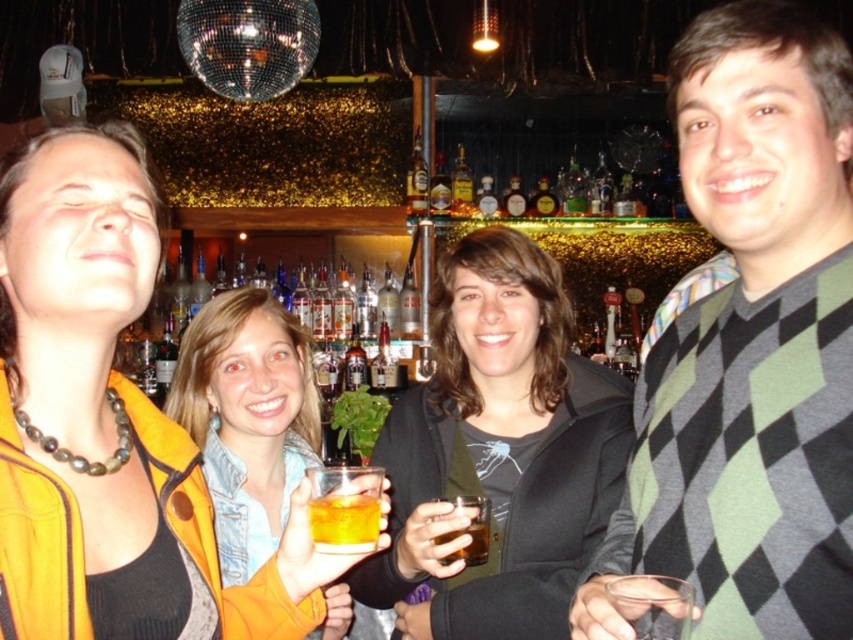
Question: Considering the real-world distances, which object is farthest from the amber glass at center?

Choices:
 (A) matte yellow jacket at upper left
 (B) amber liquid glass at center
 (C) argyle sweater at center

Answer: (A)

Question: Which point is farther to the camera?

Choices:
 (A) tap(71, 128)
 (B) tap(763, 470)

Answer: (A)

Question: Can you confirm if translucent glass at center is positioned to the left of translucent glass at lower right?

Choices:
 (A) no
 (B) yes

Answer: (B)

Question: Which object is closer to the camera taking this photo?

Choices:
 (A) amber glass at center
 (B) translucent glass at center
 (C) amber liquid glass at center

Answer: (C)

Question: Can you confirm if translucent glass at lower right is smaller than amber glass at center?

Choices:
 (A) no
 (B) yes

Answer: (B)

Question: Does translucent glass at center come in front of amber liquid glass at center?

Choices:
 (A) no
 (B) yes

Answer: (A)